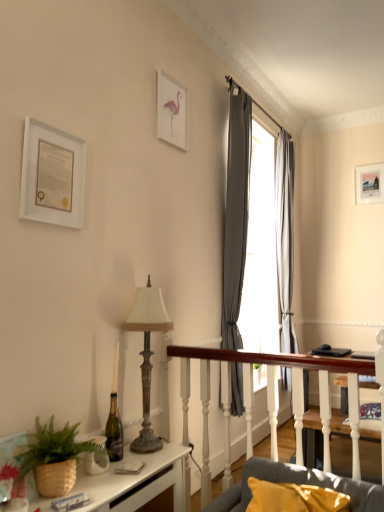
Where is `free space above white glossy desk at lower left (from a real-world perspective)`? Image resolution: width=384 pixels, height=512 pixels. free space above white glossy desk at lower left (from a real-world perspective) is located at coordinates (92, 482).